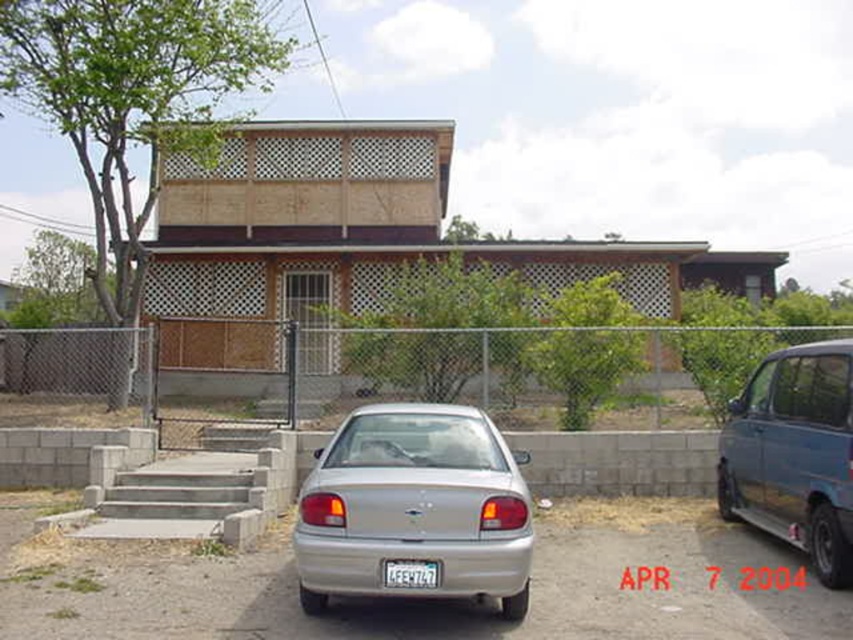
Question: Is the position of silver metallic sedan at center less distant than that of white plastic license plate at center?

Choices:
 (A) yes
 (B) no

Answer: (A)

Question: Considering the real-world distances, which object is closest to the metallic blue minivan at right?

Choices:
 (A) silver metallic sedan at center
 (B) white plastic license plate at center
 (C) metallic chain-link fence at center

Answer: (A)

Question: Which object is closer to the camera taking this photo?

Choices:
 (A) metallic blue minivan at right
 (B) white plastic license plate at center
 (C) silver metallic sedan at center

Answer: (C)

Question: Considering the real-world distances, which object is closest to the silver metallic sedan at center?

Choices:
 (A) white plastic license plate at center
 (B) metallic blue minivan at right
 (C) metallic chain-link fence at center

Answer: (A)

Question: Considering the relative positions of metallic chain-link fence at center and silver metallic sedan at center in the image provided, where is metallic chain-link fence at center located with respect to silver metallic sedan at center?

Choices:
 (A) above
 (B) below

Answer: (A)

Question: Does metallic blue minivan at right appear on the right side of white plastic license plate at center?

Choices:
 (A) yes
 (B) no

Answer: (A)